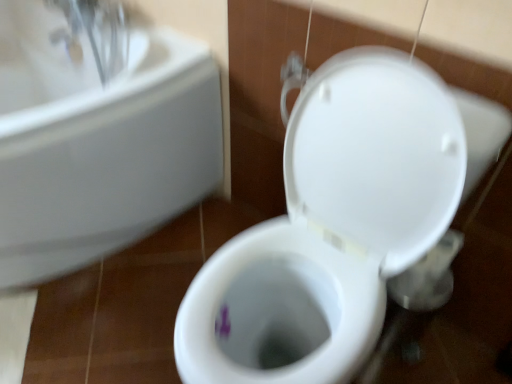
Describe the element at coordinates (97, 143) in the screenshot. The image size is (512, 384). I see `white ceramic sink at upper left` at that location.

What are the coordinates of `white ceramic sink at upper left` in the screenshot? It's located at (97, 143).

Find the location of a particular element. white glossy toilet at center is located at coordinates click(x=331, y=227).

What do you see at coordinates (331, 227) in the screenshot? The width and height of the screenshot is (512, 384). I see `white glossy toilet at center` at bounding box center [331, 227].

This screenshot has height=384, width=512. I want to click on white ceramic sink at upper left, so click(x=97, y=143).

Is white ceramic sink at upper left at the right side of white glossy toilet at center?

No, white ceramic sink at upper left is not to the right of white glossy toilet at center.

Between white ceramic sink at upper left and white glossy toilet at center, which one is positioned behind?

white ceramic sink at upper left is more distant.

Which point is more forward, (138, 114) or (342, 56)?

The point (342, 56) is more forward.

From the image's perspective, is white ceramic sink at upper left above white glossy toilet at center?

Yes, from the image's perspective, white ceramic sink at upper left is over white glossy toilet at center.

From a real-world perspective, who is located lower, white ceramic sink at upper left or white glossy toilet at center?

From a 3D spatial view, white ceramic sink at upper left is below.

Is white ceramic sink at upper left wider than white glossy toilet at center?

Correct, the width of white ceramic sink at upper left exceeds that of white glossy toilet at center.

Which of these two, white ceramic sink at upper left or white glossy toilet at center, stands shorter?

white ceramic sink at upper left is shorter.

Considering the relative sizes of white ceramic sink at upper left and white glossy toilet at center in the image provided, is white ceramic sink at upper left smaller than white glossy toilet at center?

No.

Based on the photo, is white ceramic sink at upper left positioned beyond the bounds of white glossy toilet at center?

Yes, white ceramic sink at upper left is located beyond the bounds of white glossy toilet at center.

Consider the image. Are white ceramic sink at upper left and white glossy toilet at center beside each other?

There is a gap between white ceramic sink at upper left and white glossy toilet at center.

Is white ceramic sink at upper left facing away from white glossy toilet at center?

No.

Consider the image. Can you tell me how much white ceramic sink at upper left and white glossy toilet at center differ in facing direction?

1.55 degrees.

Find the location of `toilet that appears above the white ceramic sink at upper left (from a real-world perspective)`. toilet that appears above the white ceramic sink at upper left (from a real-world perspective) is located at coordinates (331, 227).

Consider the image. Considering the positions of objects white glossy toilet at center and white ceramic sink at upper left in the image provided, who is more to the right, white glossy toilet at center or white ceramic sink at upper left?

white glossy toilet at center.

In the image, is white glossy toilet at center positioned in front of or behind white ceramic sink at upper left?

white glossy toilet at center is positioned closer to the viewer than white ceramic sink at upper left.

Does point (305, 141) come behind point (11, 55)?

No, it is in front of (11, 55).

From the image's perspective, is white glossy toilet at center located beneath white ceramic sink at upper left?

Yes, from the image's perspective, white glossy toilet at center is beneath white ceramic sink at upper left.

From a real-world perspective, relative to white ceramic sink at upper left, is white glossy toilet at center vertically above or below?

Clearly, from a real-world perspective, white glossy toilet at center is above white ceramic sink at upper left.

Considering the relative sizes of white glossy toilet at center and white ceramic sink at upper left in the image provided, is white glossy toilet at center wider than white ceramic sink at upper left?

No, white glossy toilet at center is not wider than white ceramic sink at upper left.

Which of these two, white glossy toilet at center or white ceramic sink at upper left, stands taller?

With more height is white glossy toilet at center.

From the picture: Considering the relative sizes of white glossy toilet at center and white ceramic sink at upper left in the image provided, is white glossy toilet at center smaller than white ceramic sink at upper left?

Indeed, white glossy toilet at center has a smaller size compared to white ceramic sink at upper left.

Is white glossy toilet at center completely or partially outside of white ceramic sink at upper left?

white glossy toilet at center is positioned outside white ceramic sink at upper left.

Is white glossy toilet at center far away from white ceramic sink at upper left?

white glossy toilet at center is near white ceramic sink at upper left, not far away.

Is white glossy toilet at center facing towards white ceramic sink at upper left?

No, white glossy toilet at center is not aimed at white ceramic sink at upper left.

What's the angular difference between white glossy toilet at center and white ceramic sink at upper left's facing directions?

The angle between the facing direction of white glossy toilet at center and the facing direction of white ceramic sink at upper left is 1.55 degrees.

Locate an element on the screen. The width and height of the screenshot is (512, 384). toilet in front of the white ceramic sink at upper left is located at coordinates (331, 227).

Identify the location of toilet below the white ceramic sink at upper left (from the image's perspective). (331, 227).

Locate an element on the screen. Image resolution: width=512 pixels, height=384 pixels. toilet that is on the right side of white ceramic sink at upper left is located at coordinates (331, 227).